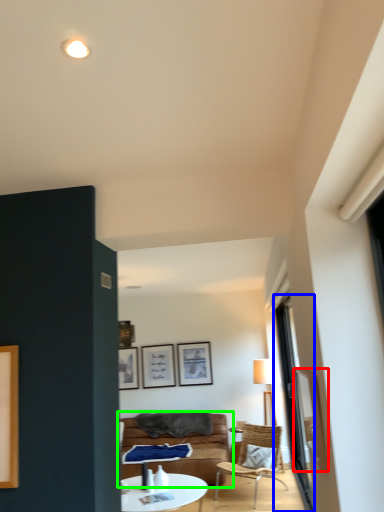
Question: Considering the real-world distances, which object is farthest from window screen (highlighted by a red box)? window (highlighted by a blue box) or studio couch (highlighted by a green box)?

Choices:
 (A) window
 (B) studio couch

Answer: (B)